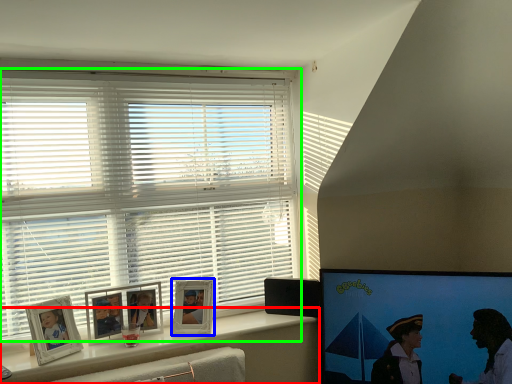
Question: Estimate the real-world distances between objects in this image. Which object is closer to window sill (highlighted by a red box), picture frame (highlighted by a blue box) or window blind (highlighted by a green box)?

Choices:
 (A) picture frame
 (B) window blind

Answer: (A)